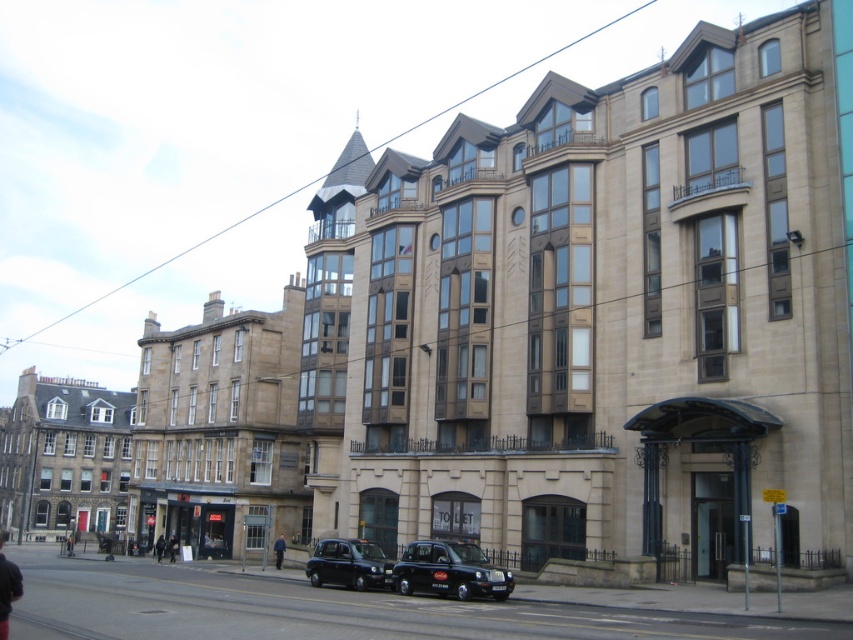
Question: Does black metallic taxi at center appear over matte black taxi at center?

Choices:
 (A) no
 (B) yes

Answer: (B)

Question: Does black metallic taxi at center lie in front of matte black taxi at center?

Choices:
 (A) yes
 (B) no

Answer: (A)

Question: Observing the image, what is the correct spatial positioning of black metallic taxi at center in reference to matte black taxi at center?

Choices:
 (A) left
 (B) right

Answer: (B)

Question: Which of the following is the closest to the observer?

Choices:
 (A) (471, 547)
 (B) (366, 582)

Answer: (A)

Question: Which of the following is the closest to the observer?

Choices:
 (A) black metallic taxi at center
 (B) matte black taxi at center

Answer: (A)

Question: Among these points, which one is nearest to the camera?

Choices:
 (A) (511, 577)
 (B) (321, 544)

Answer: (A)